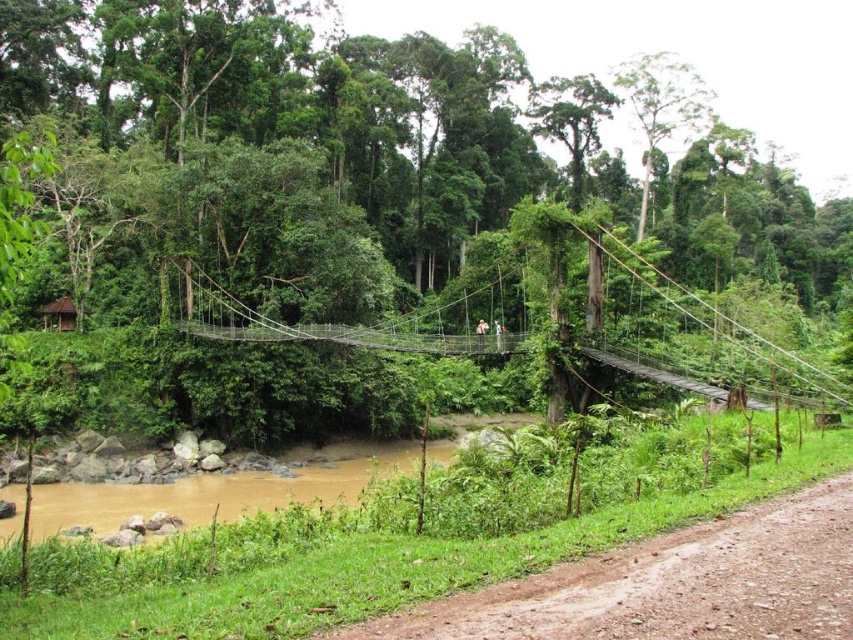
Between point (691, 557) and point (596, 240), which one is positioned in front?

Point (691, 557)

Between brown dirt track at lower right and wire mesh bridge at center, which one has more height?

wire mesh bridge at center

Does point (709, 586) lie in front of point (653, 378)?

Yes, point (709, 586) is closer to viewer.

I want to click on brown dirt track at lower right, so click(x=670, y=584).